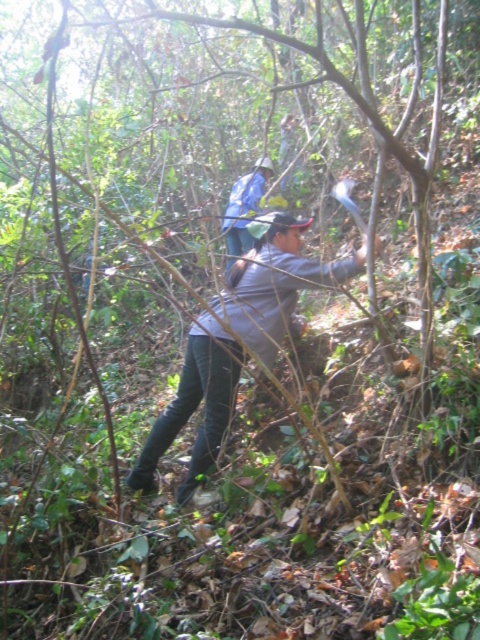
You are a hiker who needs to identify clothing items in the scene. Which of the following statements is true about the gray fabric shirt at center and the blue fabric shirt at center?

The gray fabric shirt at center is taller than the blue fabric shirt at center.